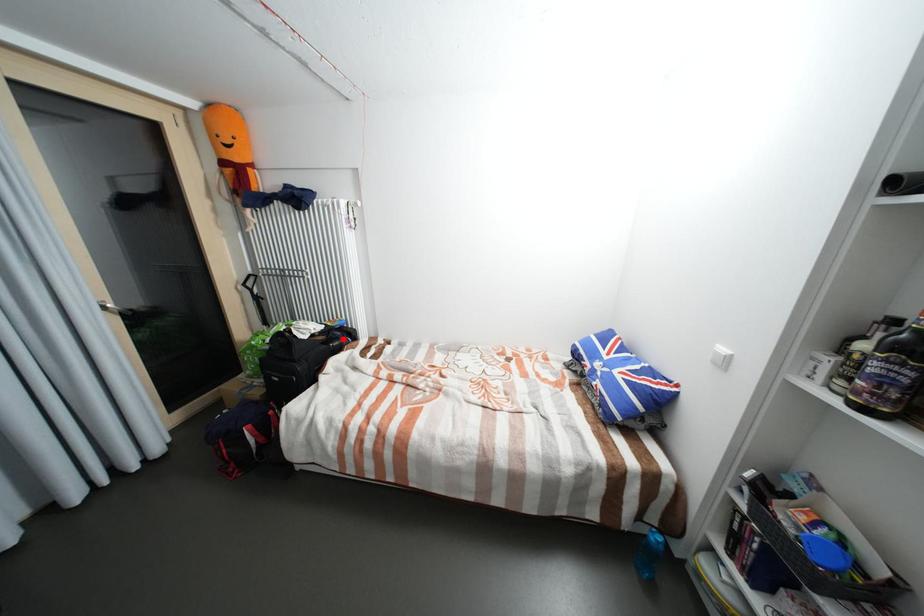
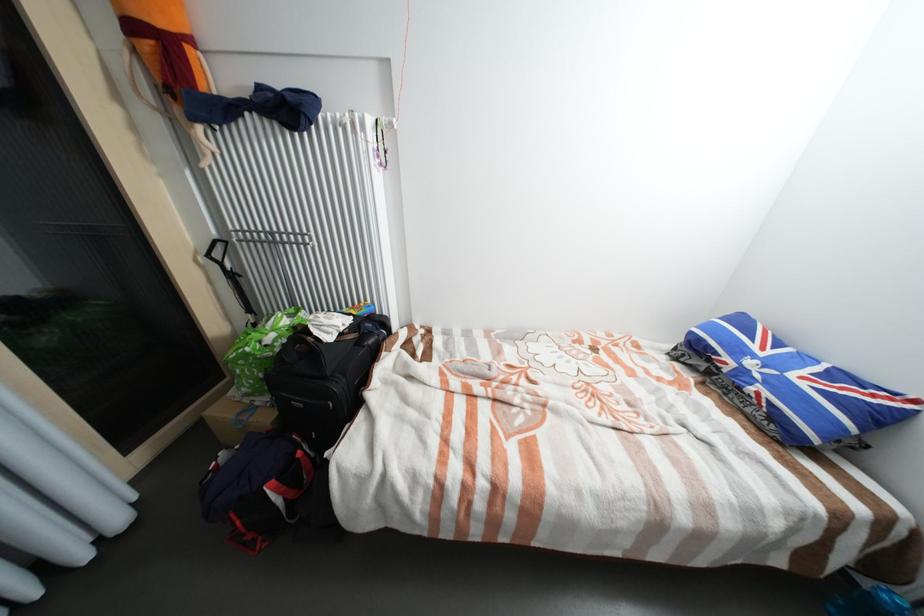
Find the pixel in the second image that matches the highlighted location in the first image.

(377, 334)